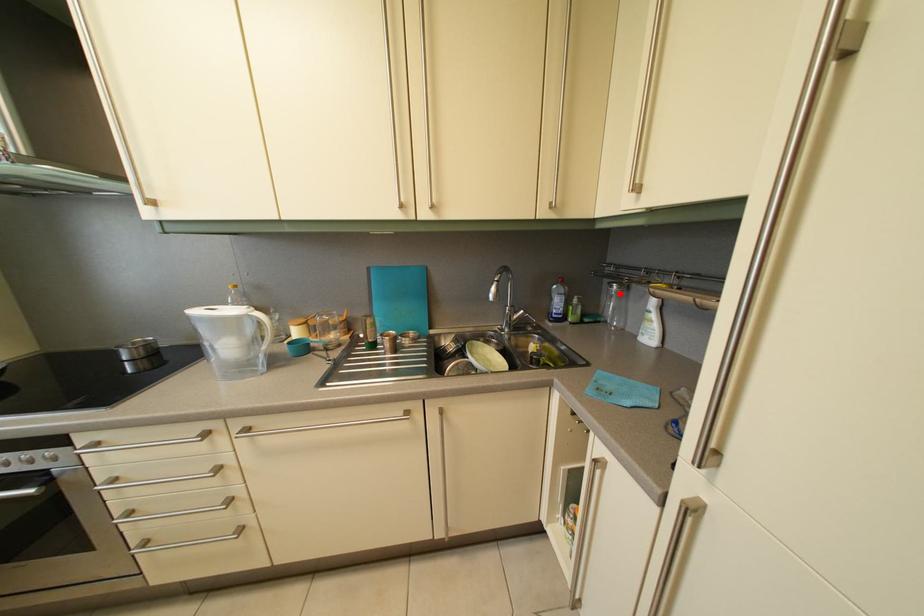
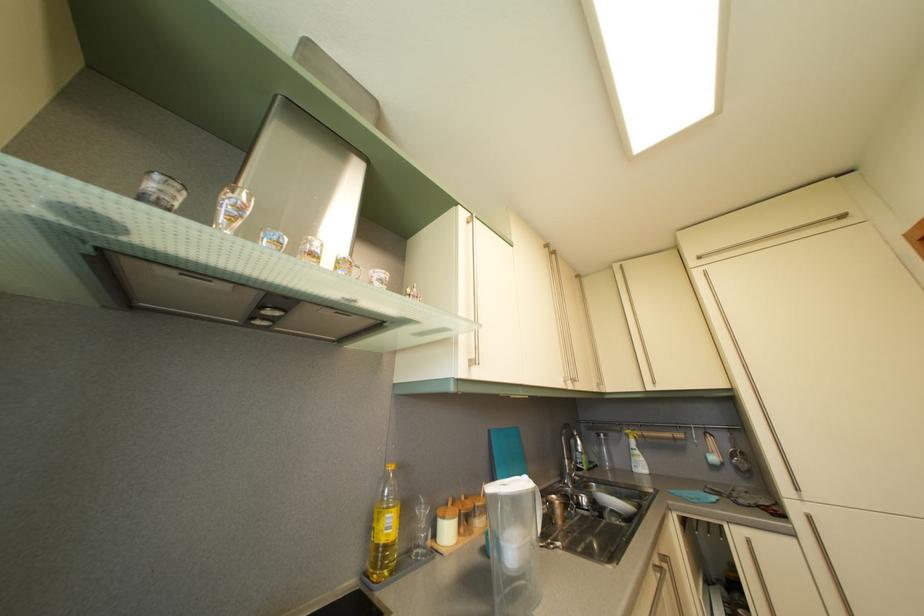
Find the pixel in the second image that matches the highlighted location in the first image.

(608, 444)